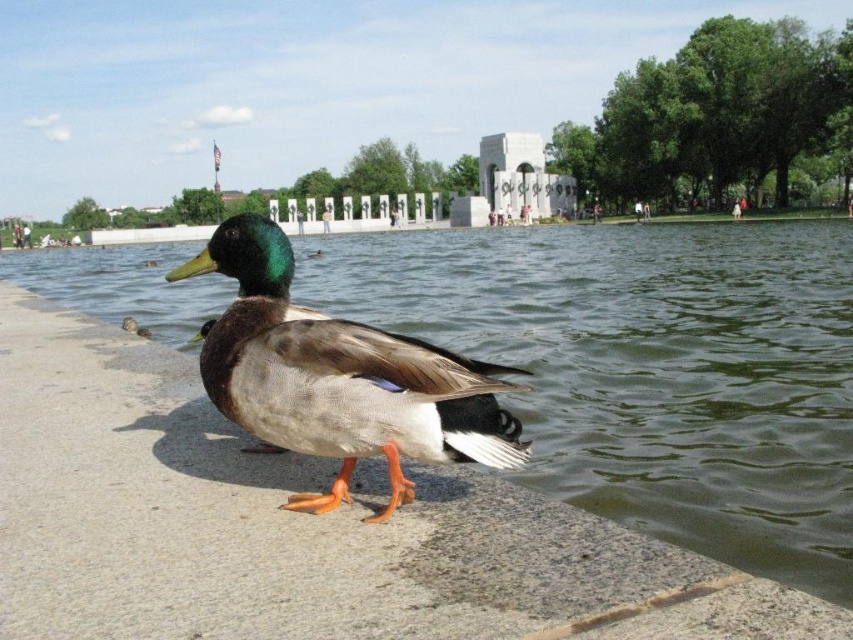
Question: Which point is closer to the camera?

Choices:
 (A) greenish water at lower left
 (B) green matte duck at center
 (C) matte brown duck at center

Answer: (C)

Question: Is greenish water at lower left thinner than matte brown duck at center?

Choices:
 (A) yes
 (B) no

Answer: (B)

Question: Which point is farther to the camera?

Choices:
 (A) green matte duck at center
 (B) matte brown duck at center
 (C) greenish water at lower left

Answer: (A)

Question: Which is farther from the green matte duck at center?

Choices:
 (A) greenish water at lower left
 (B) matte brown duck at center

Answer: (A)

Question: Is greenish water at lower left above matte brown duck at center?

Choices:
 (A) yes
 (B) no

Answer: (A)

Question: Is greenish water at lower left to the right of matte brown duck at center from the viewer's perspective?

Choices:
 (A) yes
 (B) no

Answer: (A)